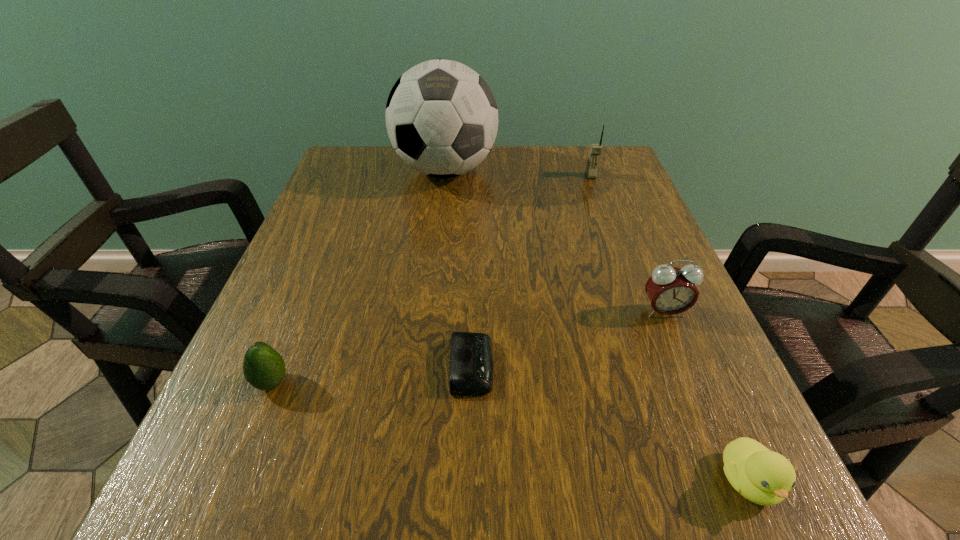
Locate an element on the screen. This screenshot has height=540, width=960. free space that is in between the leftmost object and the cellular telephone is located at coordinates (431, 279).

Identify which object is the second nearest to the duckling. Please provide its 2D coordinates. Your answer should be formatted as a tuple, i.e. [(x, y)], where the tuple contains the x and y coordinates of a point satisfying the conditions above.

[(471, 359)]

Select which object is the second closest to the leftmost object. Please provide its 2D coordinates. Your answer should be formatted as a tuple, i.e. [(x, y)], where the tuple contains the x and y coordinates of a point satisfying the conditions above.

[(441, 116)]

In order to click on blank space that satisfies the following two spatial constraints: 1. on the clock face of the taller alarm clock; 2. on the display of the nearer alarm clock in this screenshot , I will do `click(686, 366)`.

Identify the location of vacant area in the image that satisfies the following two spatial constraints: 1. on the clock face of the right alarm clock; 2. on the display of the nearer alarm clock. (686, 366).

The height and width of the screenshot is (540, 960). I want to click on vacant region that satisfies the following two spatial constraints: 1. on the front of the cellular telephone, where the keypad is located; 2. on the display of the left alarm clock, so click(659, 366).